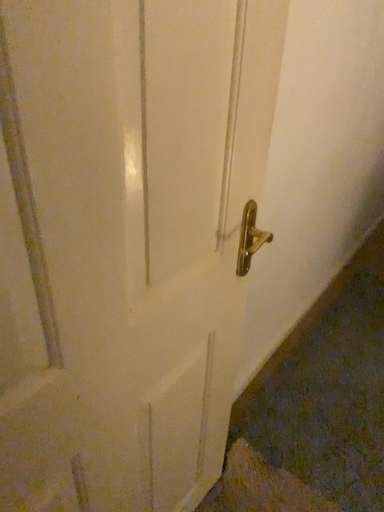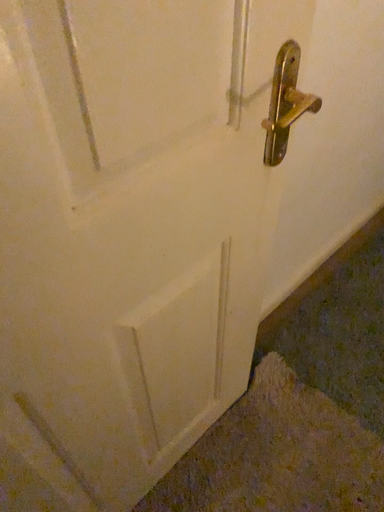
Question: Which way did the camera rotate in the video?

Choices:
 (A) rotated downward
 (B) rotated upward

Answer: (A)